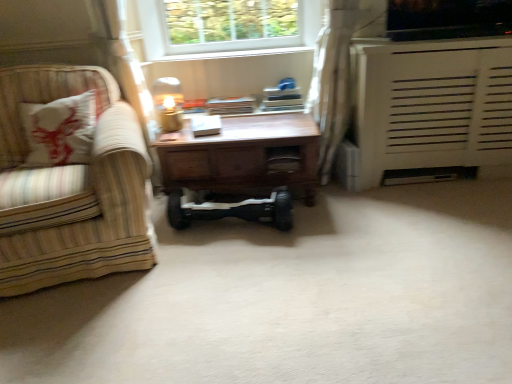
Question: Visually, is wooden desk at center positioned to the left or to the right of matte gold table lamp at center?

Choices:
 (A) right
 (B) left

Answer: (A)

Question: From their relative heights in the image, would you say wooden desk at center is taller or shorter than matte gold table lamp at center?

Choices:
 (A) short
 (B) tall

Answer: (B)

Question: Which of these objects is positioned closest to the black rubber hoverboard at center?

Choices:
 (A) white matte radiator at right
 (B) striped fabric armchair at left
 (C) white sheer curtain at upper right
 (D) wooden desk at center
 (E) matte gold table lamp at center

Answer: (D)

Question: Which of these objects is positioned farthest from the white matte radiator at right?

Choices:
 (A) white sheer curtain at upper right
 (B) striped fabric armchair at left
 (C) wooden drawer at center
 (D) matte gold table lamp at center
 (E) black rubber hoverboard at center

Answer: (B)